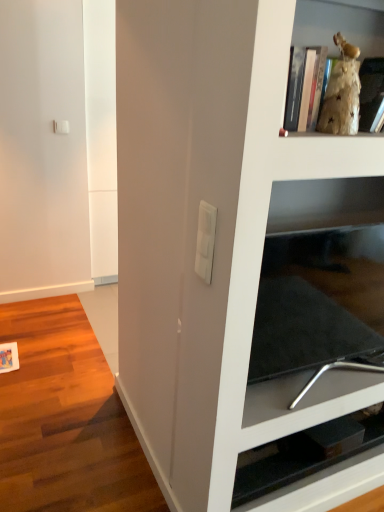
At what (x,y) coordinates should I click in order to perform the action: click on free space above black glossy tv stand at lower right, the second shelf from the front (from a real-world perspective). Please return your answer as a coordinate pair (x, y). This screenshot has height=512, width=384. Looking at the image, I should click on (312, 454).